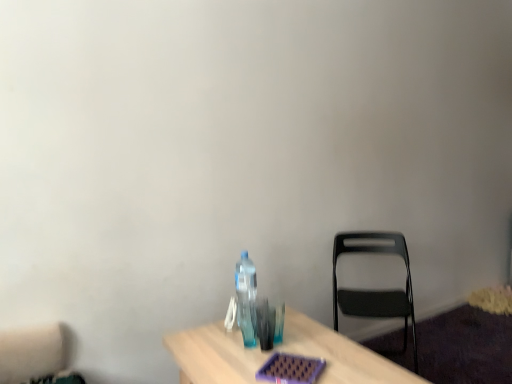
Question: From the image's perspective, relative to black plastic chair at right, is transparent plastic bottle at center above or below?

Choices:
 (A) above
 (B) below

Answer: (A)

Question: Based on their sizes in the image, would you say transparent plastic bottle at center is bigger or smaller than black plastic chair at right?

Choices:
 (A) big
 (B) small

Answer: (B)

Question: Considering the positions of transparent plastic bottle at center and black plastic chair at right in the image, is transparent plastic bottle at center taller or shorter than black plastic chair at right?

Choices:
 (A) tall
 (B) short

Answer: (B)

Question: In terms of height, does black plastic chair at right look taller or shorter compared to transparent plastic bottle at center?

Choices:
 (A) short
 (B) tall

Answer: (B)

Question: Is black plastic chair at right bigger or smaller than transparent plastic bottle at center?

Choices:
 (A) small
 (B) big

Answer: (B)

Question: Which is correct: black plastic chair at right is inside transparent plastic bottle at center, or outside of it?

Choices:
 (A) inside
 (B) outside

Answer: (B)

Question: From a real-world perspective, relative to transparent plastic bottle at center, is black plastic chair at right vertically above or below?

Choices:
 (A) above
 (B) below

Answer: (B)